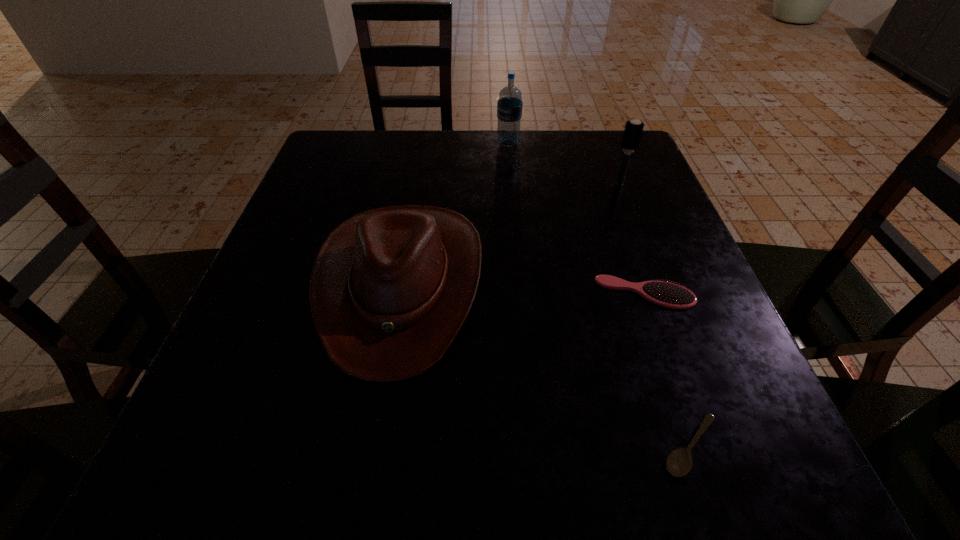
Find the location of a particular element. Image resolution: width=960 pixels, height=540 pixels. water bottle is located at coordinates (509, 106).

At what (x,y) coordinates should I click in order to perform the action: click on the farthest object. Please return your answer as a coordinate pair (x, y). This screenshot has width=960, height=540. Looking at the image, I should click on pos(509,106).

Find the location of a particular element. The height and width of the screenshot is (540, 960). the second tallest object is located at coordinates (633, 130).

I want to click on the taller hairbrush, so click(x=633, y=130).

At what (x,y) coordinates should I click in order to perform the action: click on the third tallest object. Please return your answer as a coordinate pair (x, y). The width and height of the screenshot is (960, 540). Looking at the image, I should click on (390, 288).

I want to click on cowboy hat, so click(x=390, y=288).

This screenshot has width=960, height=540. I want to click on the shorter hairbrush, so click(670, 295).

This screenshot has width=960, height=540. I want to click on the second shortest object, so click(x=670, y=295).

Find the location of a particular element. This screenshot has height=540, width=960. soupspoon is located at coordinates (679, 462).

Locate an element on the screen. The width and height of the screenshot is (960, 540). the shortest object is located at coordinates (679, 462).